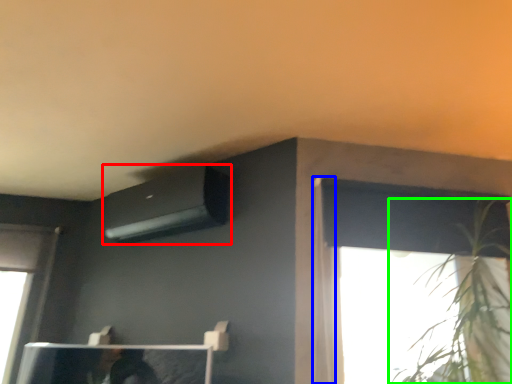
Question: Which object is positioned closest to air conditioning (highlighted by a red box)? Select from curtain (highlighted by a blue box) and houseplant (highlighted by a green box).

Choices:
 (A) curtain
 (B) houseplant

Answer: (A)